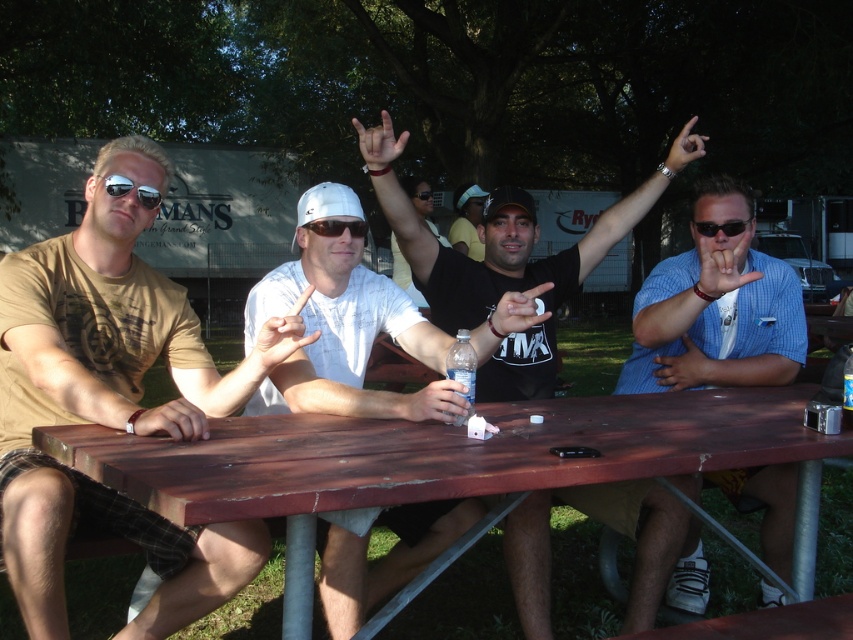
Between matte white hand at center and matte black sunglasses at center, which one is positioned higher?

matte white hand at center

Is matte white hand at center below matte black sunglasses at center?

No, matte white hand at center is not below matte black sunglasses at center.

Find the location of a particular element. This screenshot has height=640, width=853. matte white hand at center is located at coordinates (379, 141).

Between point (364, 301) and point (474, 228), which one is positioned behind?

Point (474, 228)

Who is higher up, white matte cap at center or matte black t-shirt at center?

matte black t-shirt at center

Describe the element at coordinates (335, 317) in the screenshot. I see `white matte cap at center` at that location.

The width and height of the screenshot is (853, 640). I want to click on white matte cap at center, so click(x=335, y=317).

Is black matte t-shirt at center wider than matte plastic bottle at center?

Yes, black matte t-shirt at center is wider than matte plastic bottle at center.

Is black matte t-shirt at center bigger than matte plastic bottle at center?

Yes.

Is point (508, 554) positioned in front of point (433, 400)?

No, it is behind (433, 400).

Identify the location of black matte t-shirt at center. (569, 248).